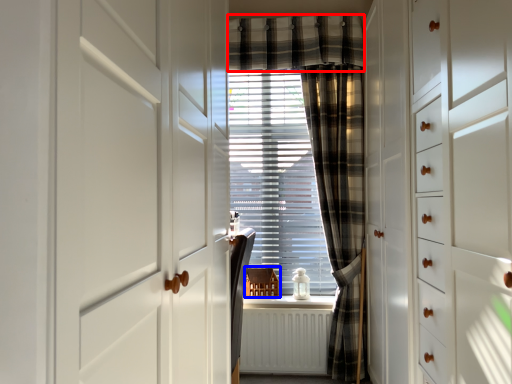
Question: Among these objects, which one is farthest to the camera, plaid (highlighted by a red box) or furniture (highlighted by a blue box)?

Choices:
 (A) plaid
 (B) furniture

Answer: (B)